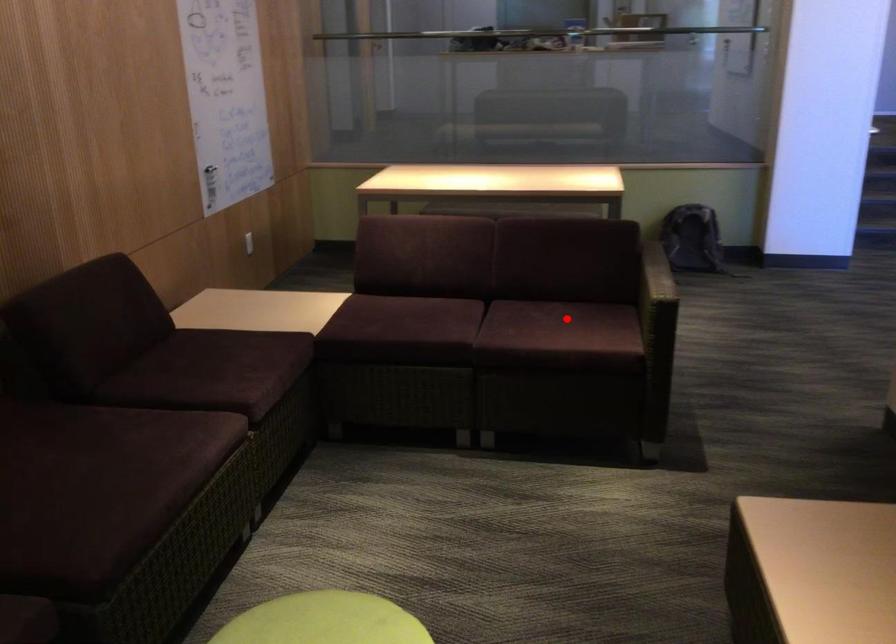
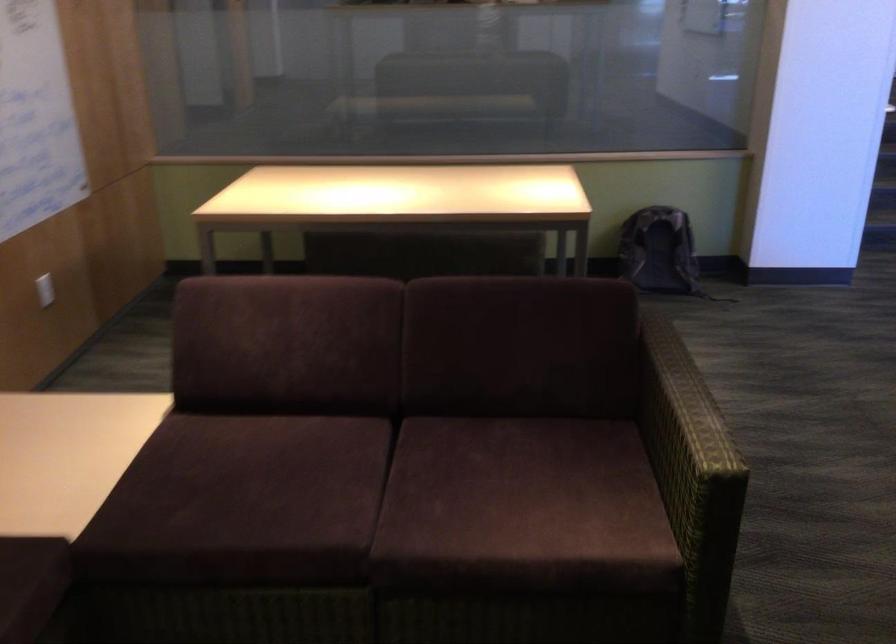
Locate, in the second image, the point that corresponds to the highlighted location in the first image.

(526, 474)